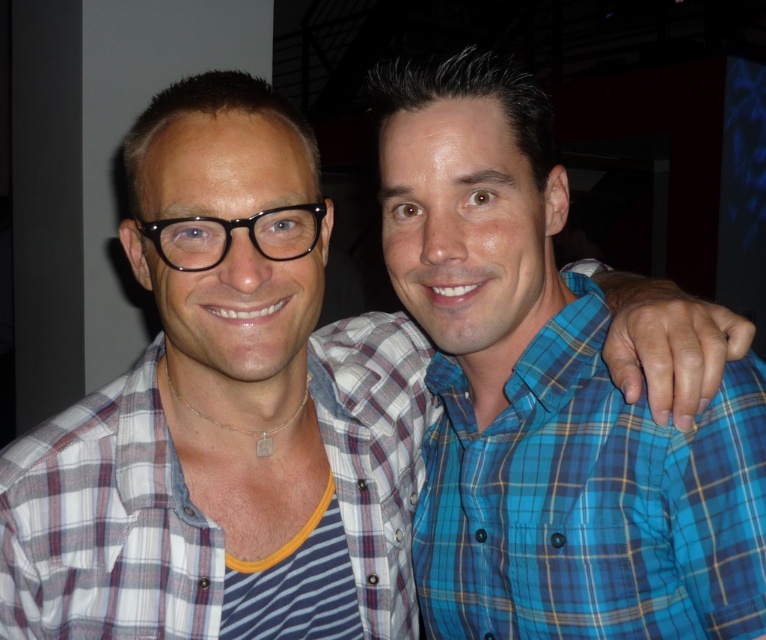
Which of these two, blue plaid shirt at right or white plaid shirt at center, stands shorter?

white plaid shirt at center is shorter.

Is blue plaid shirt at right taller than white plaid shirt at center?

Correct, blue plaid shirt at right is much taller as white plaid shirt at center.

Is point (496, 600) closer to viewer compared to point (80, 420)?

No, it is not.

Where is `blue plaid shirt at right`? The height and width of the screenshot is (640, 766). blue plaid shirt at right is located at coordinates (591, 500).